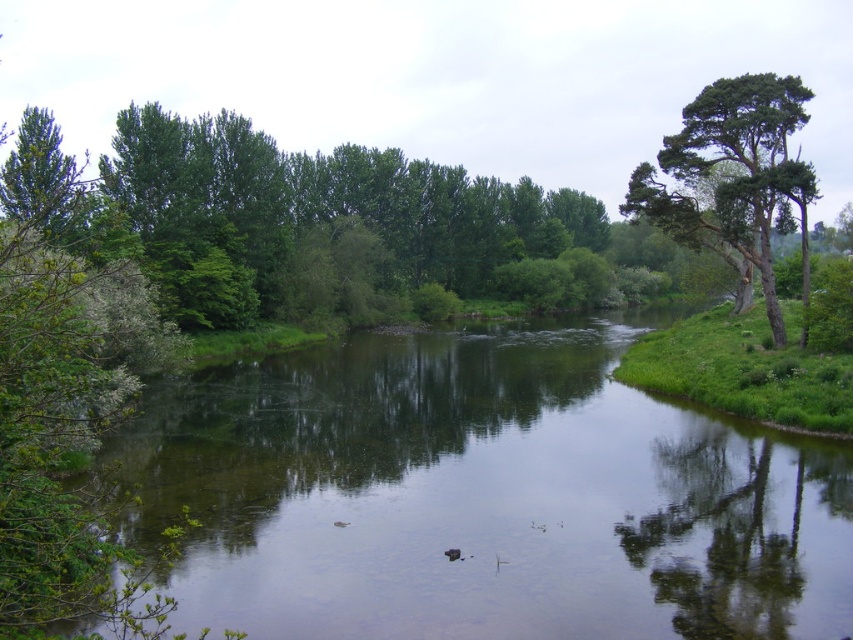
You are standing on the bank of the river and want to cross to the other side. The green smooth water at center is 11.51 meters away from you. If your maximum jumping distance is 10 meters, can you safely jump across the river at this point?

The green smooth water at center is 11.51 meters away from the viewer. Since your maximum jumping distance is 10 meters, you cannot safely jump across the river at this point as the distance exceeds your capability.

You are an explorer trying to cross the river. You see the green smooth water at center and the green rough bark tree at upper right. Which direction should you go to avoid the tree?

→ The green smooth water at center is to the left of the green rough bark tree at upper right, so to avoid the tree, you should go to the left side of the river.

You are standing at the point with coordinates point (x=711, y=173) and want to walk towards the river. Which direction should you go to reach the river first, towards point (x=498, y=618) or away from it?

You should go towards point (x=498, y=618) because it is in front of point (x=711, y=173), meaning it is closer to the river.